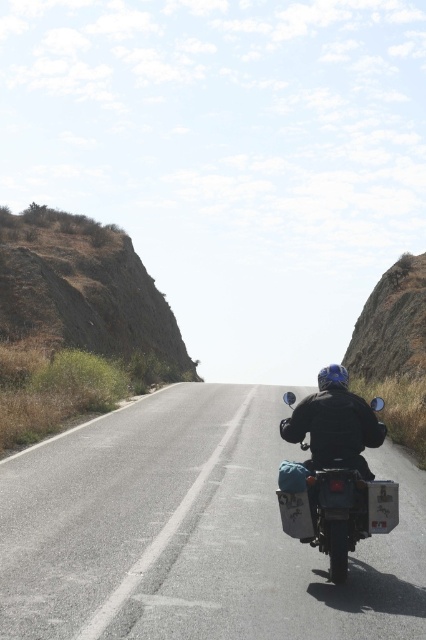
Which is more to the right, asphalt road at center or matte black motorcycle at center?

matte black motorcycle at center

Is asphalt road at center below matte black motorcycle at center?

Yes.

The image size is (426, 640). I want to click on asphalt road at center, so click(x=192, y=532).